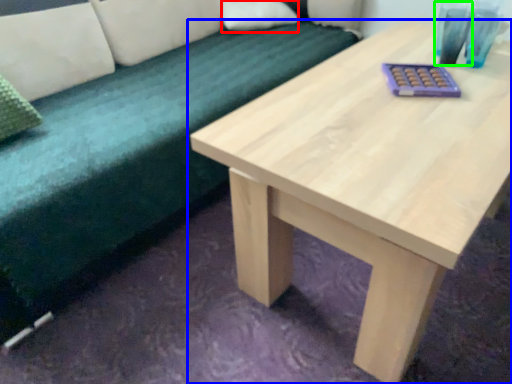
Question: Which is nearer to the pillow (highlighted by a red box)? table (highlighted by a blue box) or glass vase (highlighted by a green box).

Choices:
 (A) table
 (B) glass vase

Answer: (B)